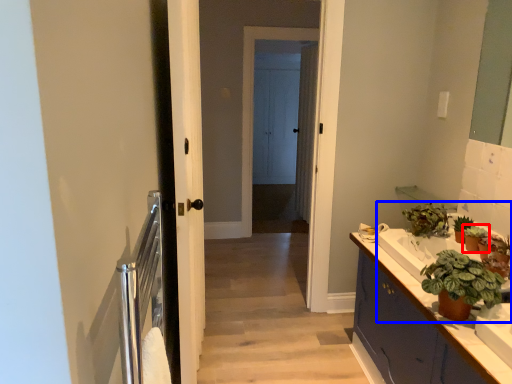
Question: Which object appears farthest to the camera in this image, houseplant (highlighted by a red box) or sink (highlighted by a blue box)?

Choices:
 (A) houseplant
 (B) sink

Answer: (A)